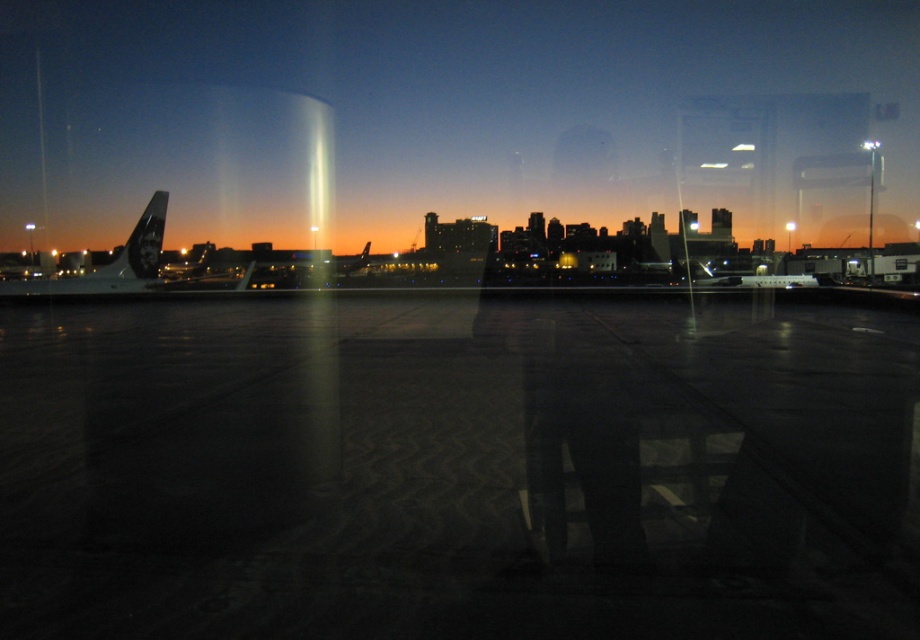
Is white matte airplane at left further to the viewer compared to metallic silver airplane at center?

No, white matte airplane at left is closer to the viewer.

Is white matte airplane at left thinner than metallic silver airplane at center?

Yes.

Is point (99, 292) positioned after point (698, 262)?

No, (99, 292) is closer to viewer.

This screenshot has width=920, height=640. What are the coordinates of `white matte airplane at left` in the screenshot? It's located at (110, 262).